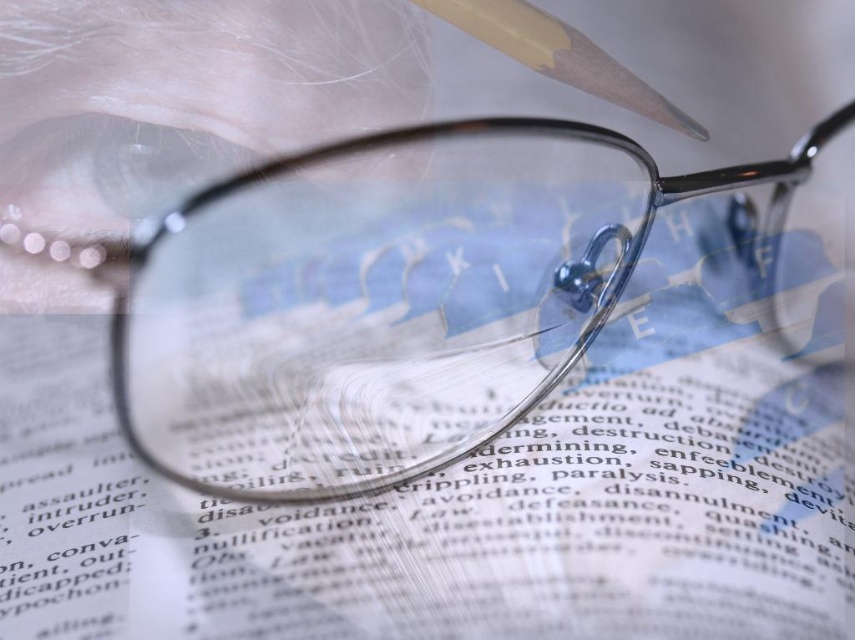
You are trying to read the text on the transparent plastic book at center, but your view is blocked by the matte black glasses at center. Can you move the glasses to see the text clearly?

The matte black glasses at center is behind the transparent plastic book at center, so moving the glasses would allow you to see the text clearly.

You are trying to place the matte wood pencil at upper center vertically on top of the transparent plastic book at center. Based on their heights, will the pencil be shorter than the book?

The transparent plastic book at center has a greater height compared to matte wood pencil at upper center, so yes, the pencil will be shorter than the book when placed vertically on top of it.

You are trying to read the text on the transparent plastic book at center, but the reflection on the matte black glasses at center is blocking your view. Which object should you move to see the text clearly?

You should move the matte black glasses at center because the transparent plastic book at center is positioned under it, so removing the glasses would allow you to see the text without obstruction.